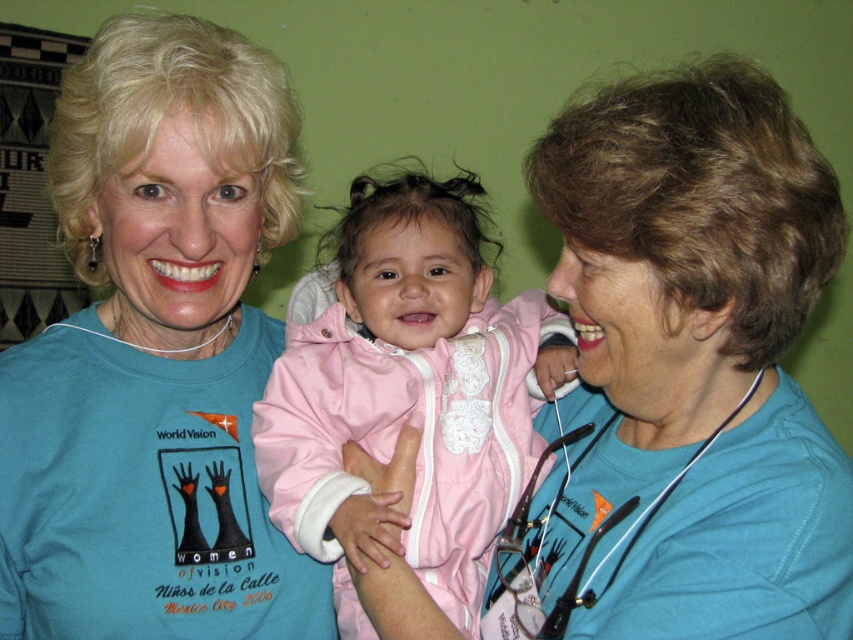
You are a photographer who wants to take a picture of the two adults in the scene. You notice the matte blue shirt at center and the pink satin jacket at center. Which one is positioned to the left?

The matte blue shirt at center is to the left of the pink satin jacket at center.

You are a photographer standing in front of the green wall and want to take a photo of the matte blue shirt at center and the white plastic stethoscope at lower right. Which object will appear larger in the photo?

The matte blue shirt at center will appear larger in the photo because it is closer to the photographer than the white plastic stethoscope at lower right.